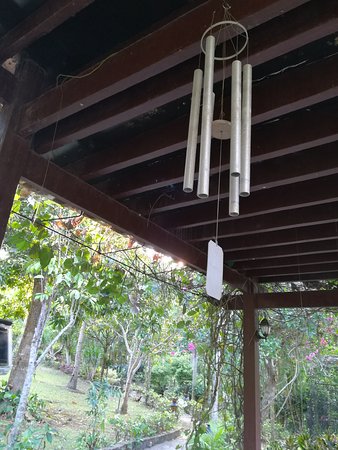
You are a GUI agent. You are given a task and a screenshot of the screen. Output one action in this format:
    pyautogui.click(x=<x>, y=<y>)
    Task: Click on the fixture light
    
    Given the screenshot: What is the action you would take?
    pyautogui.click(x=265, y=321)